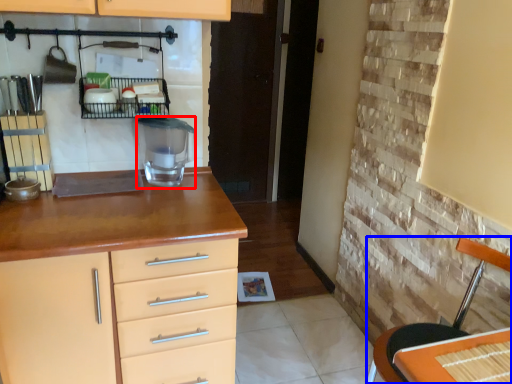
Question: Among these objects, which one is farthest to the camera, appliance (highlighted by a red box) or chair (highlighted by a blue box)?

Choices:
 (A) appliance
 (B) chair

Answer: (A)